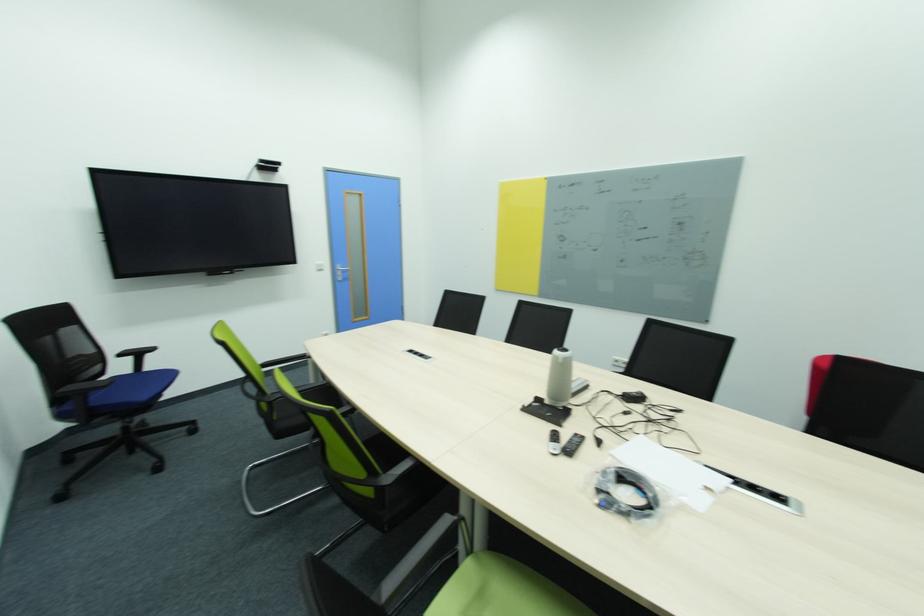
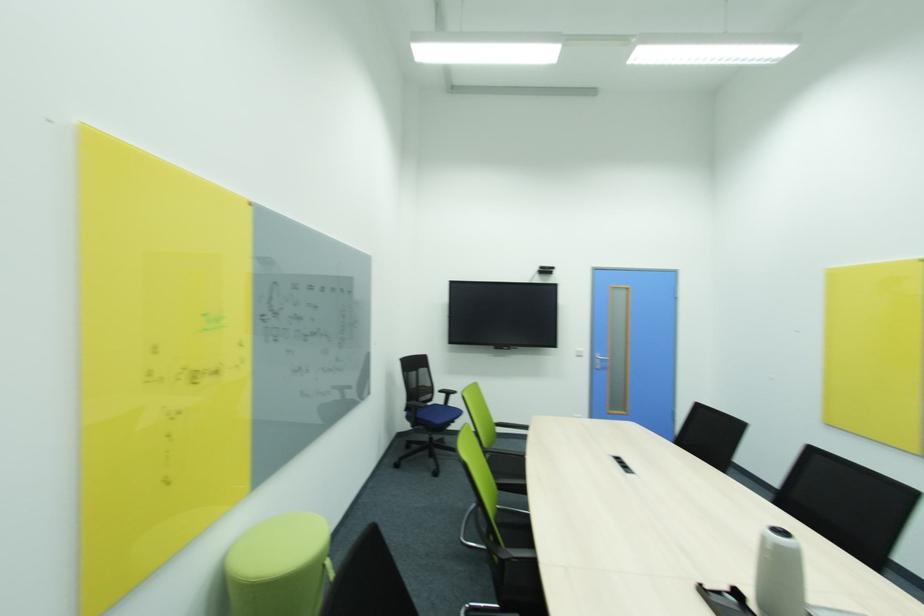
Locate, in the second image, the point that corresponds to point (131, 429) in the first image.

(434, 440)